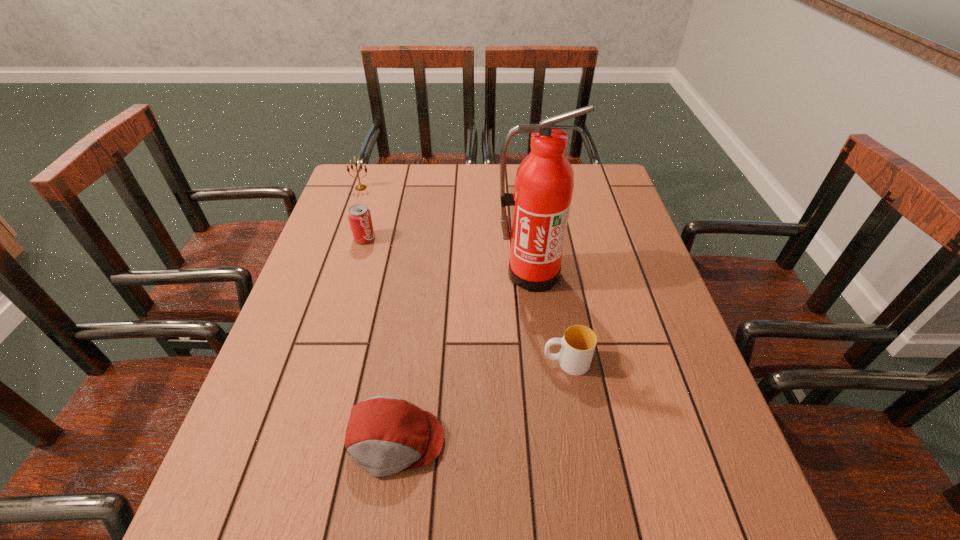
This screenshot has width=960, height=540. I want to click on free space at the left edge of the desktop, so 250,428.

The width and height of the screenshot is (960, 540). Identify the location of vacant area at the right edge of the desktop. (701, 391).

The height and width of the screenshot is (540, 960). In the image, there is a desktop. What are the coordinates of `vacant space at the far left corner` in the screenshot? It's located at (354, 184).

Identify the location of vacant region at the far right corner of the desktop. The height and width of the screenshot is (540, 960). (599, 174).

Where is `empty location between the second nearest object and the candelabrum`? This screenshot has height=540, width=960. empty location between the second nearest object and the candelabrum is located at coordinates (464, 275).

Find the location of a particular element. free space between the fourth nearest object and the cup is located at coordinates (466, 300).

The height and width of the screenshot is (540, 960). In order to click on vacant region between the candelabrum and the cup in this screenshot , I will do `click(464, 275)`.

What are the coordinates of `free space between the candelabrum and the nearest object` in the screenshot? It's located at (378, 314).

I want to click on free space between the fire extinguisher and the third object from left to right, so click(x=463, y=357).

At what (x,y) coordinates should I click in order to perform the action: click on free spot between the tallest object and the second farthest object. Please return your answer as a coordinate pair (x, y). This screenshot has height=540, width=960. Looking at the image, I should click on (447, 256).